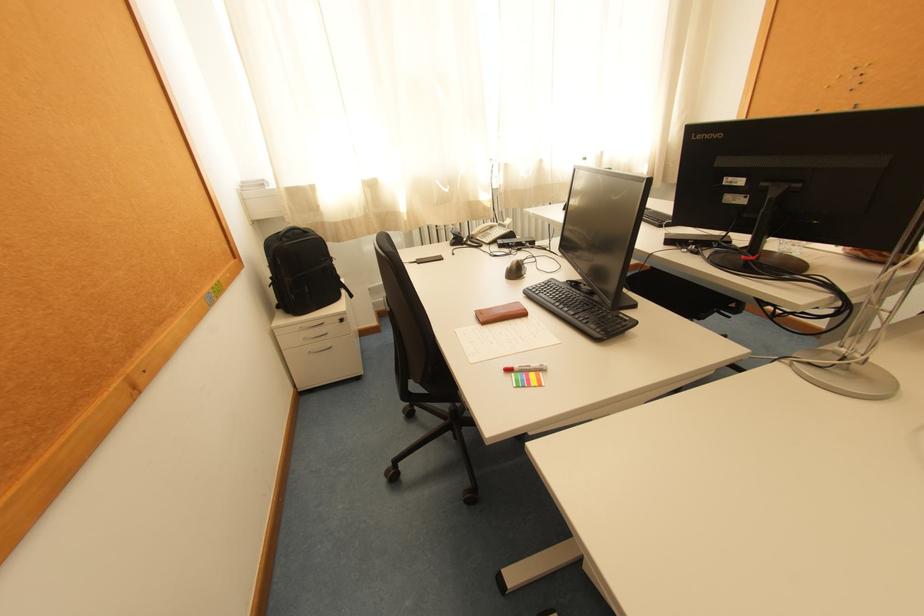
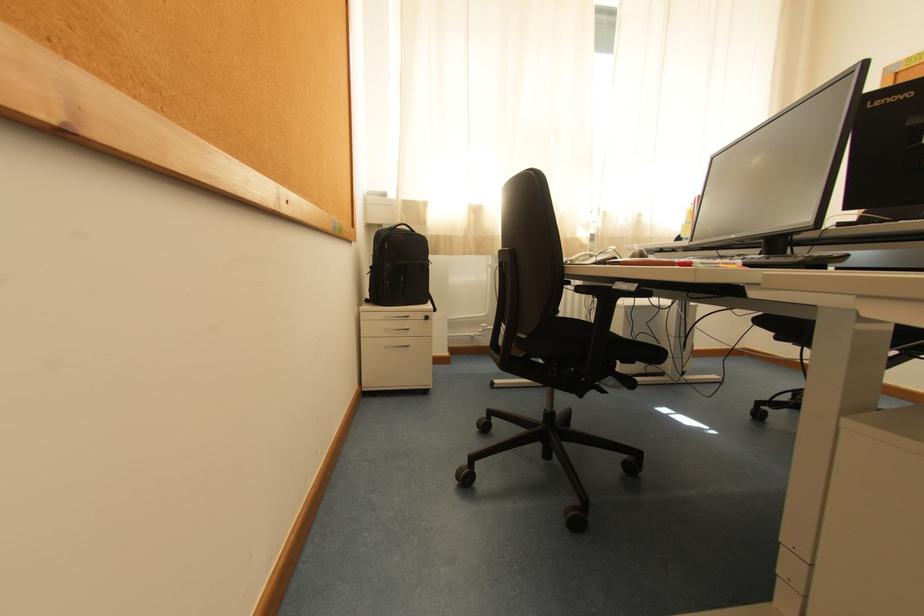
Question: The images are taken continuously from a first-person perspective. In which direction is your viewpoint rotating?

Choices:
 (A) Left
 (B) Right
 (C) Up
 (D) Down

Answer: (C)